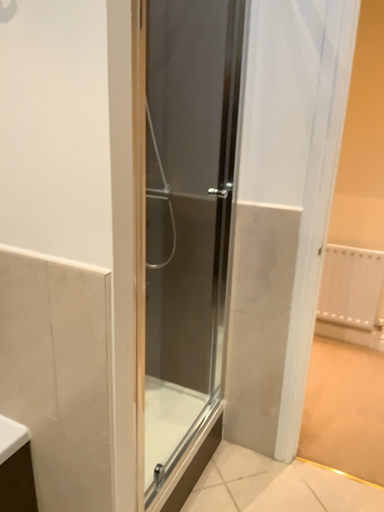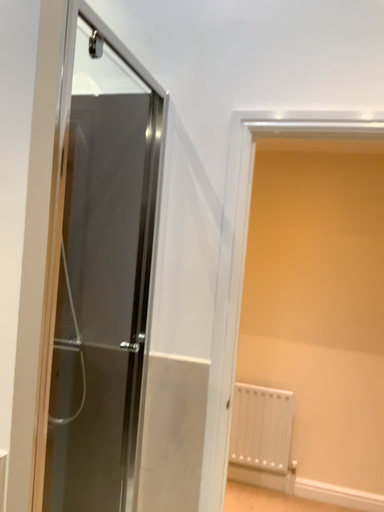
Question: How did the camera likely rotate when shooting the video?

Choices:
 (A) rotated downward
 (B) rotated upward

Answer: (B)